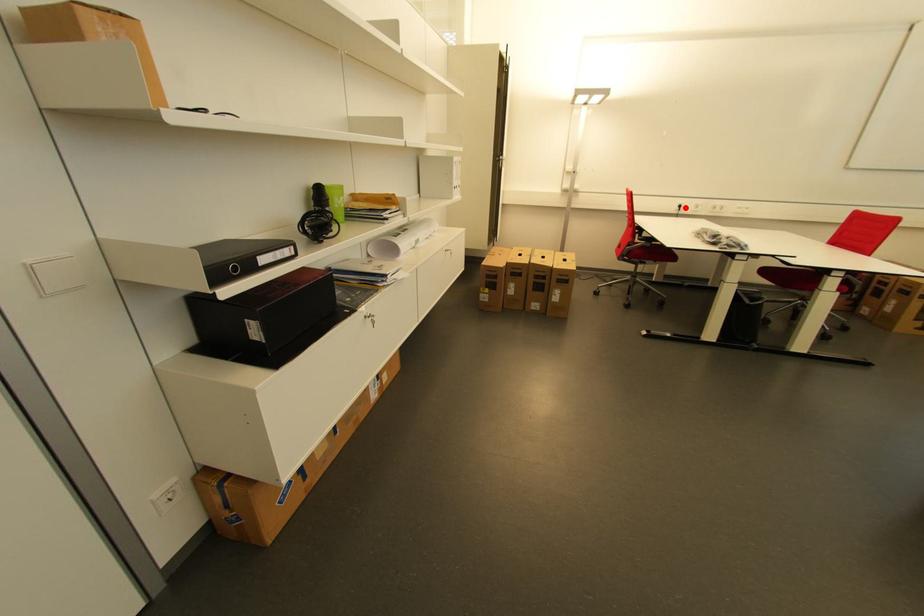
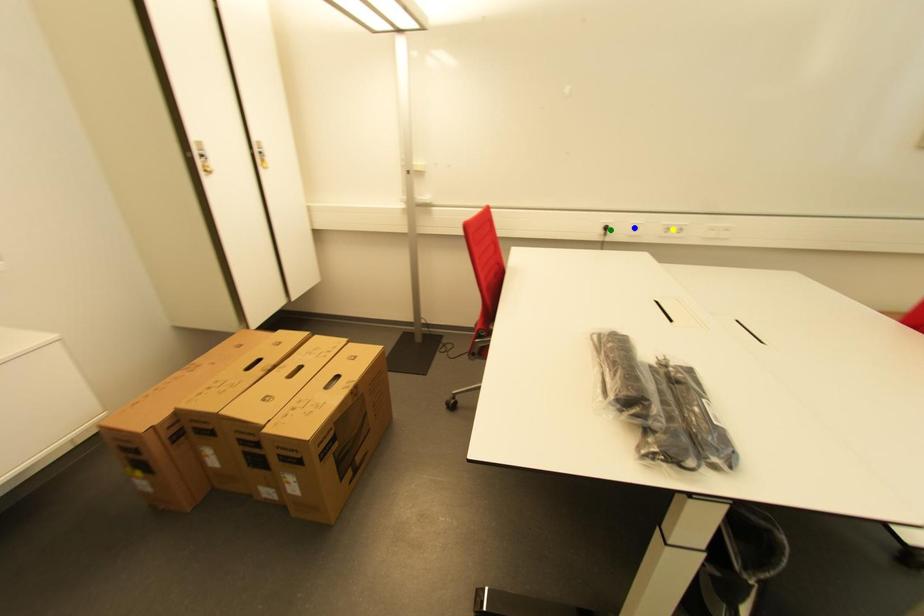
Question: I am providing you with two images of the same scene from different viewpoints. A red point is marked on the first image. You are given multiple points on the second image. In image 2, which mark is for the same physical point as the one in image 1?

Choices:
 (A) yellow point
 (B) blue point
 (C) green point

Answer: (C)